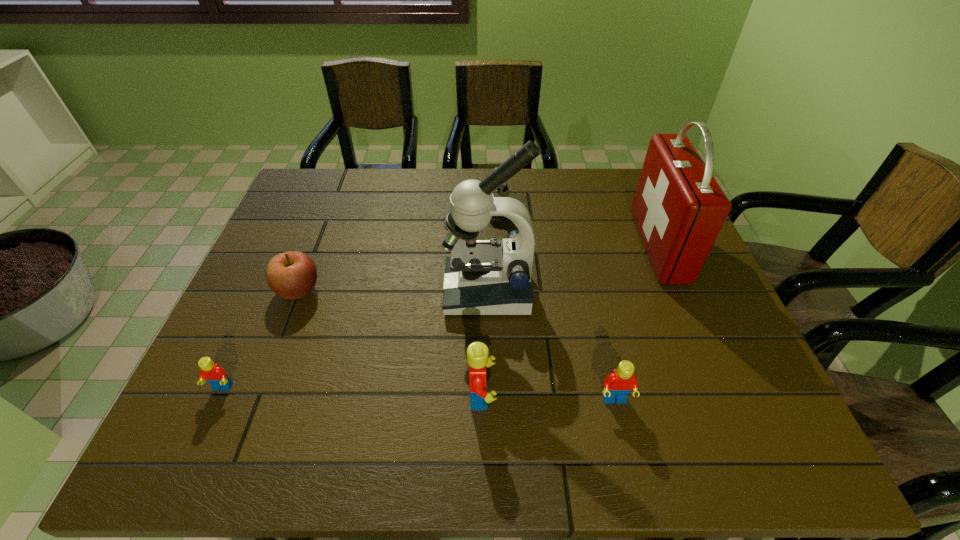
Locate an element on the screen. Image resolution: width=960 pixels, height=540 pixels. vacant space that satisfies the following two spatial constraints: 1. on the front face of the first-aid kit; 2. on the face of the shortest object is located at coordinates (719, 388).

The width and height of the screenshot is (960, 540). Find the location of `vacant region that satisfies the following two spatial constraints: 1. on the front face of the rightmost object; 2. on the face of the shortest object`. vacant region that satisfies the following two spatial constraints: 1. on the front face of the rightmost object; 2. on the face of the shortest object is located at coordinates (719, 388).